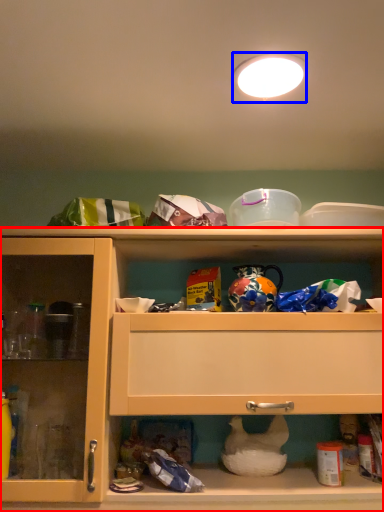
Question: Which object appears closest to the camera in this image, cabinetry (highlighted by a red box) or lighting (highlighted by a blue box)?

Choices:
 (A) cabinetry
 (B) lighting

Answer: (B)